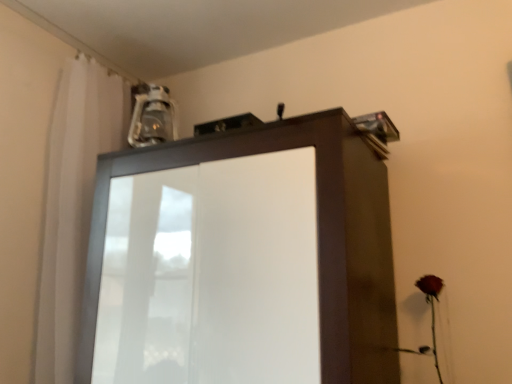
Question: Is white sheer curtain at upper left positioned beyond the bounds of matte red rose at lower right?

Choices:
 (A) no
 (B) yes

Answer: (B)

Question: Is white sheer curtain at upper left oriented towards matte red rose at lower right?

Choices:
 (A) yes
 (B) no

Answer: (A)

Question: Is white sheer curtain at upper left turned away from matte red rose at lower right?

Choices:
 (A) yes
 (B) no

Answer: (B)

Question: Is white sheer curtain at upper left far away from matte red rose at lower right?

Choices:
 (A) no
 (B) yes

Answer: (B)

Question: Does white sheer curtain at upper left appear on the right side of matte red rose at lower right?

Choices:
 (A) no
 (B) yes

Answer: (A)

Question: Is matte brown cupboard at upper center situated inside matte red rose at lower right or outside?

Choices:
 (A) outside
 (B) inside

Answer: (A)

Question: From the image's perspective, is matte brown cupboard at upper center above or below matte red rose at lower right?

Choices:
 (A) above
 (B) below

Answer: (A)

Question: In the image, is matte brown cupboard at upper center on the left side or the right side of matte red rose at lower right?

Choices:
 (A) right
 (B) left

Answer: (B)

Question: Considering the positions of point (154, 344) and point (435, 364), is point (154, 344) closer or farther from the camera than point (435, 364)?

Choices:
 (A) closer
 (B) farther

Answer: (A)

Question: Considering their positions, is white sheer curtain at upper left located in front of or behind matte brown cupboard at upper center?

Choices:
 (A) behind
 (B) front

Answer: (A)

Question: From the image's perspective, is white sheer curtain at upper left above or below matte brown cupboard at upper center?

Choices:
 (A) above
 (B) below

Answer: (A)

Question: Considering the positions of white sheer curtain at upper left and matte brown cupboard at upper center in the image, is white sheer curtain at upper left taller or shorter than matte brown cupboard at upper center?

Choices:
 (A) tall
 (B) short

Answer: (A)

Question: In the image, is white sheer curtain at upper left on the left side or the right side of matte brown cupboard at upper center?

Choices:
 (A) left
 (B) right

Answer: (A)

Question: In terms of width, does matte brown cupboard at upper center look wider or thinner when compared to white sheer curtain at upper left?

Choices:
 (A) thin
 (B) wide

Answer: (B)

Question: From a real-world perspective, is matte brown cupboard at upper center positioned above or below white sheer curtain at upper left?

Choices:
 (A) below
 (B) above

Answer: (A)